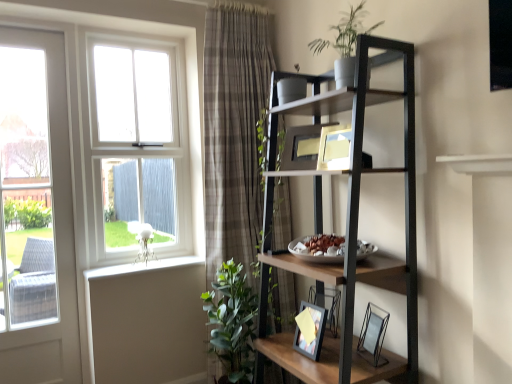
Question: From a real-world perspective, is metallic black shelf at upper right on white wood window at upper left?

Choices:
 (A) no
 (B) yes

Answer: (A)

Question: Considering the relative sizes of metallic black shelf at upper right and white wood window at upper left in the image provided, is metallic black shelf at upper right shorter than white wood window at upper left?

Choices:
 (A) no
 (B) yes

Answer: (A)

Question: Is metallic black shelf at upper right far from white wood window at upper left?

Choices:
 (A) no
 (B) yes

Answer: (A)

Question: Considering the relative sizes of metallic black shelf at upper right and white wood window at upper left in the image provided, is metallic black shelf at upper right taller than white wood window at upper left?

Choices:
 (A) no
 (B) yes

Answer: (B)

Question: Could white wood window at upper left be considered to be inside metallic black shelf at upper right?

Choices:
 (A) no
 (B) yes

Answer: (A)

Question: Does metallic black shelf at upper right have a greater width compared to white wood window at upper left?

Choices:
 (A) yes
 (B) no

Answer: (A)

Question: Considering the relative sizes of green matte plant at upper center and clear glass picture frame at lower right, the second picture frame in the top-to-bottom sequence, in the image provided, is green matte plant at upper center taller than clear glass picture frame at lower right, the second picture frame in the top-to-bottom sequence,?

Choices:
 (A) yes
 (B) no

Answer: (A)

Question: From a real-world perspective, does green matte plant at upper center stand above clear glass picture frame at lower right, the first picture frame when ordered from right to left?

Choices:
 (A) yes
 (B) no

Answer: (A)

Question: Is green matte plant at upper center aimed at clear glass picture frame at lower right, which ranks as the 2th picture frame in back-to-front order?

Choices:
 (A) yes
 (B) no

Answer: (B)

Question: From a real-world perspective, is green matte plant at upper center below clear glass picture frame at lower right, the second picture frame in the top-to-bottom sequence?

Choices:
 (A) no
 (B) yes

Answer: (A)

Question: Can you confirm if green matte plant at upper center is positioned to the left of clear glass picture frame at lower right, which ranks as the 2th picture frame in back-to-front order?

Choices:
 (A) yes
 (B) no

Answer: (A)

Question: Can you confirm if green matte plant at upper center is wider than clear glass picture frame at lower right, the first picture frame when ordered from right to left?

Choices:
 (A) yes
 (B) no

Answer: (A)

Question: Is clear glass picture frame at lower right, which appears as the first picture frame when ordered from the bottom, oriented away from white painted wood at lower left?

Choices:
 (A) no
 (B) yes

Answer: (A)